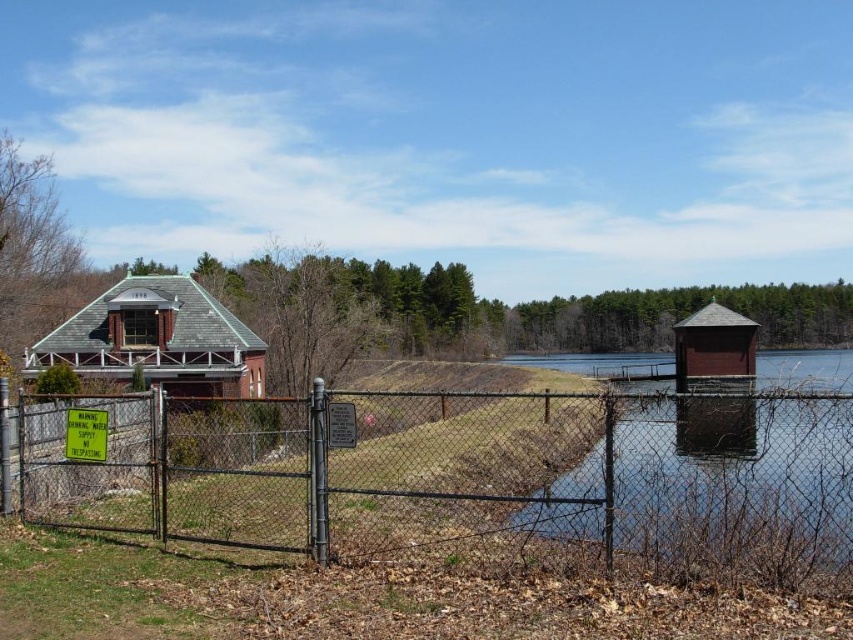
Question: In this image, where is rusty chain-link fence at center located relative to green plastic sign at center?

Choices:
 (A) left
 (B) right

Answer: (B)

Question: Does brown wooden dock at right appear under white plastic sign at center?

Choices:
 (A) no
 (B) yes

Answer: (B)

Question: Estimate the real-world distances between objects in this image. Which object is farther from the brown wooden dock at right?

Choices:
 (A) green plastic sign at center
 (B) rusty chain-link fence at center
 (C) white plastic sign at center

Answer: (B)

Question: Can you confirm if green plastic sign at center is positioned above white plastic sign at center?

Choices:
 (A) no
 (B) yes

Answer: (A)

Question: Among these objects, which one is farthest from the camera?

Choices:
 (A) white plastic sign at center
 (B) rusty chain-link fence at center

Answer: (A)

Question: Which object is positioned farthest from the green plastic sign at center?

Choices:
 (A) rusty chain-link fence at center
 (B) brown wooden dock at right
 (C) white plastic sign at center

Answer: (B)